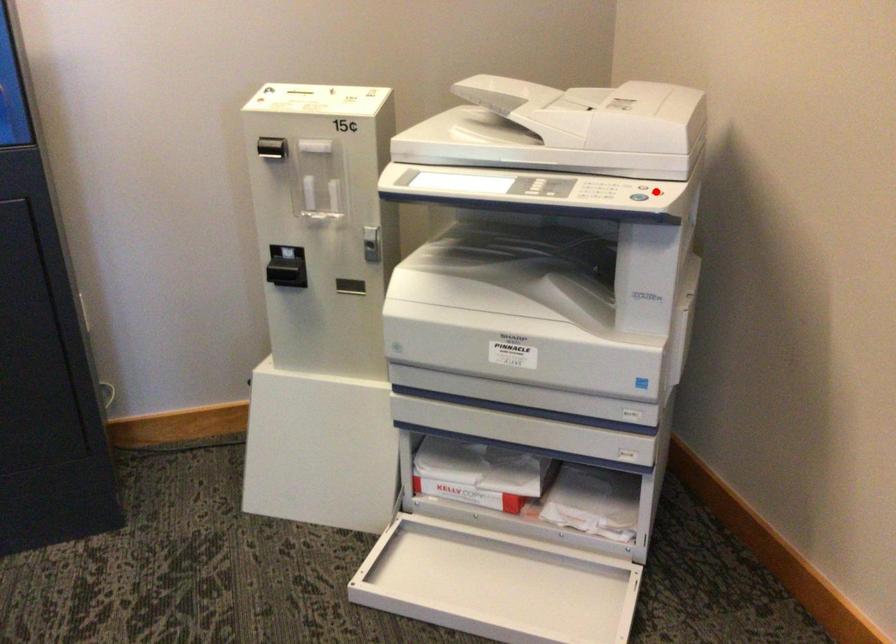
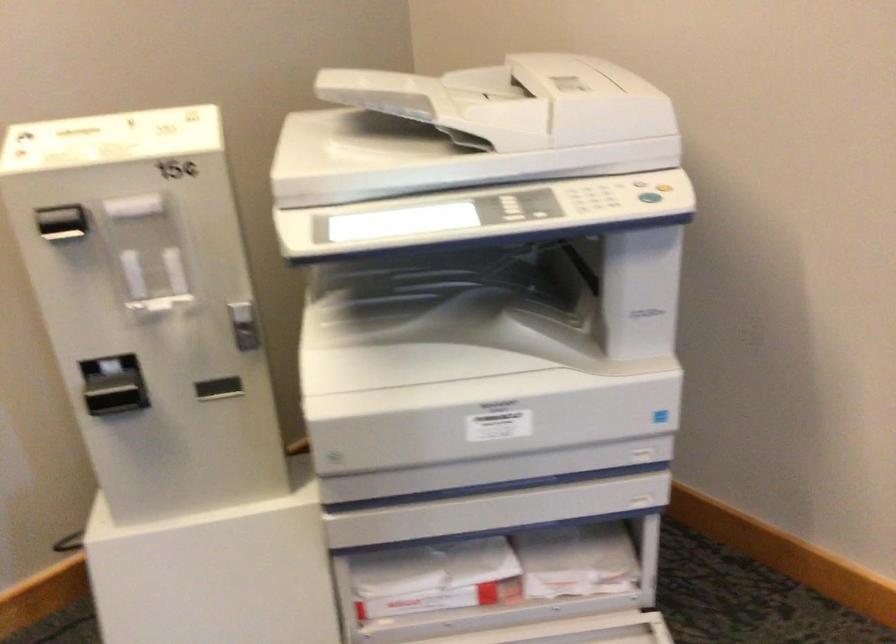
In the second image, find the point that corresponds to the highlighted location in the first image.

(664, 185)